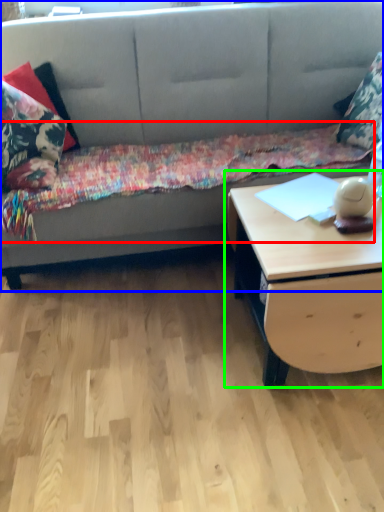
Question: Estimate the real-world distances between objects in this image. Which object is closer to blanket (highlighted by a red box), studio couch (highlighted by a blue box) or table (highlighted by a green box)?

Choices:
 (A) studio couch
 (B) table

Answer: (A)